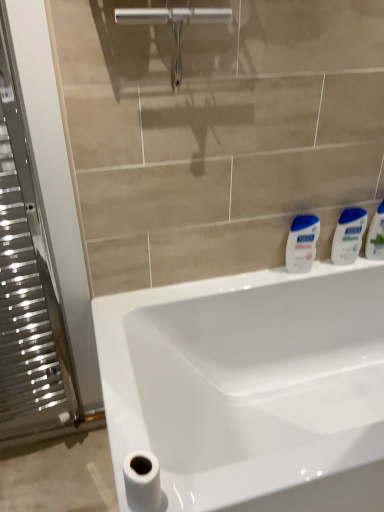
Question: Considering the relative positions of white glossy sink at center and white glossy lotion at right, the 1th toiletry in the right-to-left sequence, in the image provided, is white glossy sink at center to the right of white glossy lotion at right, the 1th toiletry in the right-to-left sequence, from the viewer's perspective?

Choices:
 (A) no
 (B) yes

Answer: (A)

Question: From a real-world perspective, is white glossy sink at center on white glossy lotion at right, the 1th toiletry in the right-to-left sequence?

Choices:
 (A) yes
 (B) no

Answer: (B)

Question: Does white glossy sink at center have a greater height compared to white glossy lotion at right, which is counted as the second toiletry, starting from the left?

Choices:
 (A) yes
 (B) no

Answer: (A)

Question: Is white glossy sink at center further to the viewer compared to white glossy lotion at right, which is counted as the second toiletry, starting from the left?

Choices:
 (A) no
 (B) yes

Answer: (A)

Question: From the image's perspective, does white glossy sink at center appear lower than white glossy lotion at right, the 1th toiletry in the right-to-left sequence?

Choices:
 (A) yes
 (B) no

Answer: (A)

Question: Is white glossy sink at center aimed at white glossy lotion at right, the 1th toiletry in the right-to-left sequence?

Choices:
 (A) yes
 (B) no

Answer: (B)

Question: Is white matte toilet paper at lower left at the right side of white glossy lotion at right, the 1th toiletry in the right-to-left sequence?

Choices:
 (A) no
 (B) yes

Answer: (A)

Question: Is white glossy lotion at right, the 1th toiletry in the right-to-left sequence, a part of white matte toilet paper at lower left?

Choices:
 (A) yes
 (B) no

Answer: (B)

Question: Is white matte toilet paper at lower left further to camera compared to white glossy lotion at right, the 1th toiletry in the right-to-left sequence?

Choices:
 (A) no
 (B) yes

Answer: (A)

Question: Does white matte toilet paper at lower left have a lesser width compared to white glossy lotion at right, the 1th toiletry in the right-to-left sequence?

Choices:
 (A) no
 (B) yes

Answer: (A)

Question: From the image's perspective, would you say white matte toilet paper at lower left is shown under white glossy lotion at right, which is counted as the second toiletry, starting from the left?

Choices:
 (A) no
 (B) yes

Answer: (B)

Question: Is white matte toilet paper at lower left completely or partially outside of white glossy lotion at right, which is counted as the second toiletry, starting from the left?

Choices:
 (A) no
 (B) yes

Answer: (B)

Question: Is white glossy lotion at right, arranged as the first toiletry when viewed from the left, looking in the opposite direction of white matte toilet paper at lower left?

Choices:
 (A) yes
 (B) no

Answer: (B)